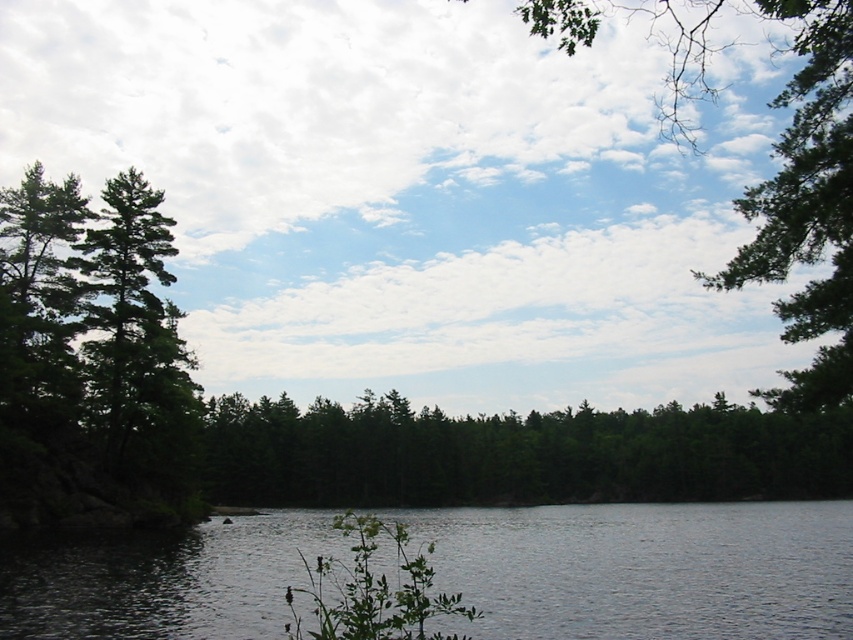
Does smooth gray water at lower left have a larger size compared to green matte tree at center?

No.

Who is taller, smooth gray water at lower left or green matte tree at center?

green matte tree at center is taller.

Is point (805, 560) in front of point (627, 500)?

Yes, it is in front of point (627, 500).

Locate an element on the screen. This screenshot has height=640, width=853. smooth gray water at lower left is located at coordinates (646, 568).

Does smooth gray water at lower left have a lesser height compared to green matte tree at left?

Yes.

Which is above, smooth gray water at lower left or green matte tree at left?

green matte tree at left

Which is in front, point (252, 636) or point (192, 508)?

Positioned in front is point (252, 636).

The width and height of the screenshot is (853, 640). I want to click on smooth gray water at lower left, so click(x=646, y=568).

Is smooth gray water at lower left below green leafy tree at upper right?

Yes, smooth gray water at lower left is below green leafy tree at upper right.

Between smooth gray water at lower left and green leafy tree at upper right, which one appears on the left side from the viewer's perspective?

smooth gray water at lower left

Find the location of a particular element. The image size is (853, 640). smooth gray water at lower left is located at coordinates (646, 568).

Locate an element on the screen. The image size is (853, 640). smooth gray water at lower left is located at coordinates (646, 568).